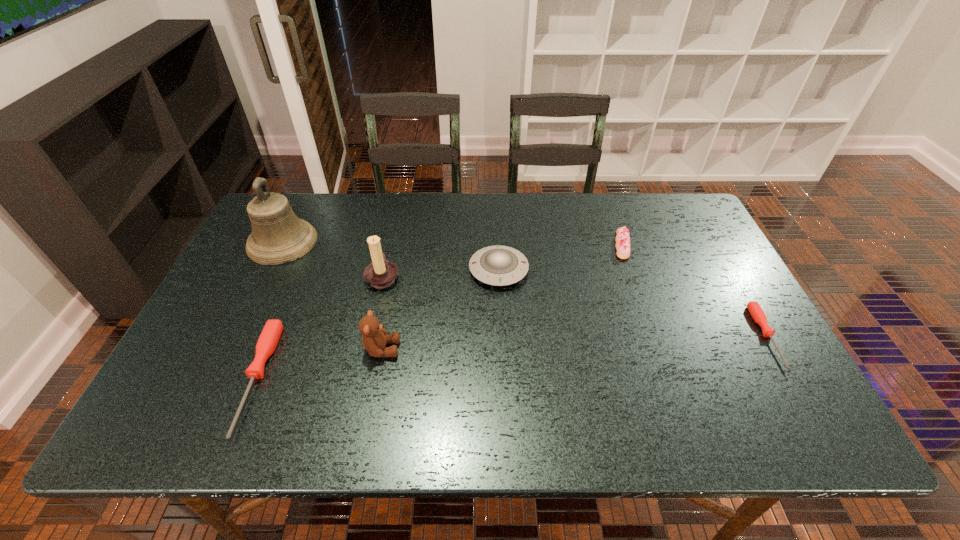
Where is `the taller screwdriver`? the taller screwdriver is located at coordinates (270, 335).

You are a GUI agent. You are given a task and a screenshot of the screen. Output one action in this format:
    pyautogui.click(x=<x>, y=<y>)
    Task: Click on the shortest object
    The height and width of the screenshot is (540, 960).
    Given the screenshot: What is the action you would take?
    pyautogui.click(x=757, y=313)

What are the coordinates of `the right screwdriver` in the screenshot? It's located at (757, 313).

Identify the location of the sixth object from left to right. The width and height of the screenshot is (960, 540). (622, 238).

Find the location of a particular element. The height and width of the screenshot is (540, 960). the second tallest object is located at coordinates (381, 273).

Identify the location of the fourth shortest object. (497, 265).

The width and height of the screenshot is (960, 540). I want to click on saucer, so click(x=497, y=265).

Image resolution: width=960 pixels, height=540 pixels. Find the location of `the tallest object`. the tallest object is located at coordinates (278, 236).

You are a GUI agent. You are given a task and a screenshot of the screen. Output one action in this format:
    pyautogui.click(x=<x>, y=<y>)
    Task: Click on the teddy bear
    Image resolution: width=960 pixels, height=540 pixels.
    Given the screenshot: What is the action you would take?
    pyautogui.click(x=375, y=337)

Identify the location of free space located 0.210m on the left of the sixth object from left to right. The height and width of the screenshot is (540, 960). (543, 245).